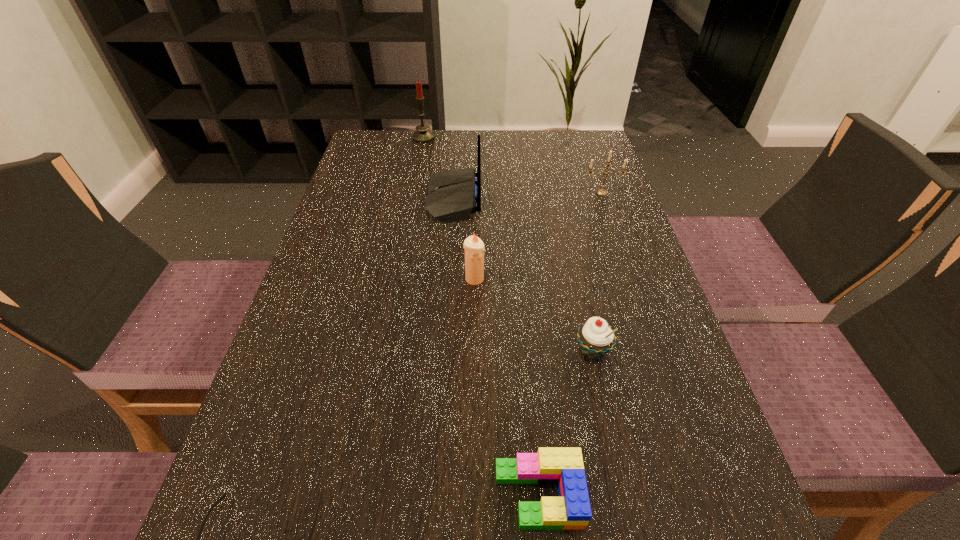
Where is `vacant space that satisfies the following two spatial constraints: 1. on the back side of the fourth nearest object; 2. on the right side of the rightmost candle`? This screenshot has width=960, height=540. vacant space that satisfies the following two spatial constraints: 1. on the back side of the fourth nearest object; 2. on the right side of the rightmost candle is located at coordinates (475, 193).

Locate an element on the screen. The width and height of the screenshot is (960, 540). free spot that satisfies the following two spatial constraints: 1. on the back of the router; 2. on the left side of the second candle from right to left is located at coordinates (448, 279).